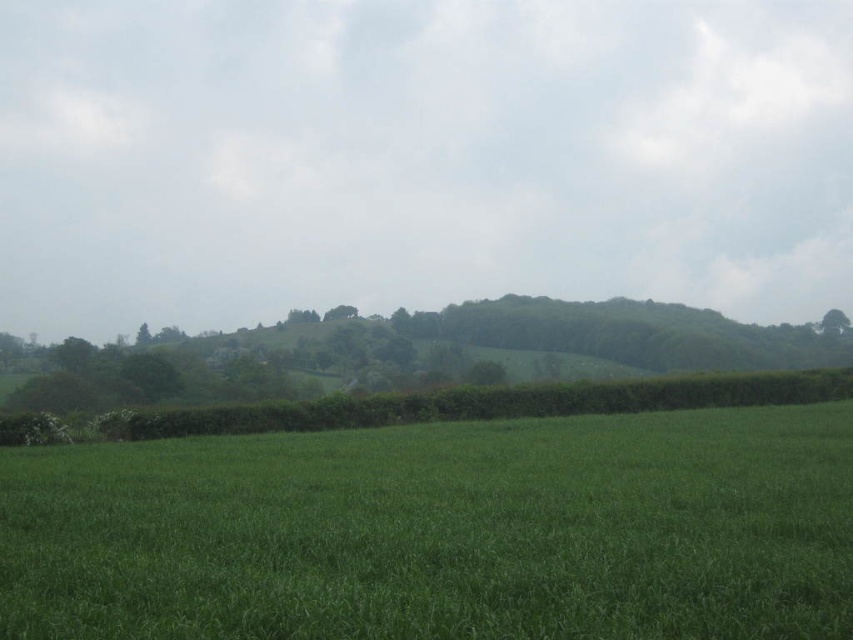
Is green grassy hill at center taller than green leafy tree at center?

Yes, green grassy hill at center is taller than green leafy tree at center.

Based on the photo, does green grassy hill at center have a lesser width compared to green leafy tree at center?

No, green grassy hill at center is not thinner than green leafy tree at center.

Which is in front, point (480, 179) or point (442, 326)?

Point (442, 326) is more forward.

Where is `green grassy hill at center`? green grassy hill at center is located at coordinates (418, 156).

Does green grassy hill at center have a greater width compared to green grassy pasture at lower center?

Indeed, green grassy hill at center has a greater width compared to green grassy pasture at lower center.

Is green grassy hill at center below green grassy pasture at lower center?

Actually, green grassy hill at center is above green grassy pasture at lower center.

What do you see at coordinates (418, 156) in the screenshot? I see `green grassy hill at center` at bounding box center [418, 156].

The width and height of the screenshot is (853, 640). Find the location of `green grassy hill at center`. green grassy hill at center is located at coordinates (418, 156).

Based on the photo, does green grassy hill at center have a greater width compared to green leafy tree at upper right?

Correct, the width of green grassy hill at center exceeds that of green leafy tree at upper right.

The image size is (853, 640). I want to click on green grassy hill at center, so click(418, 156).